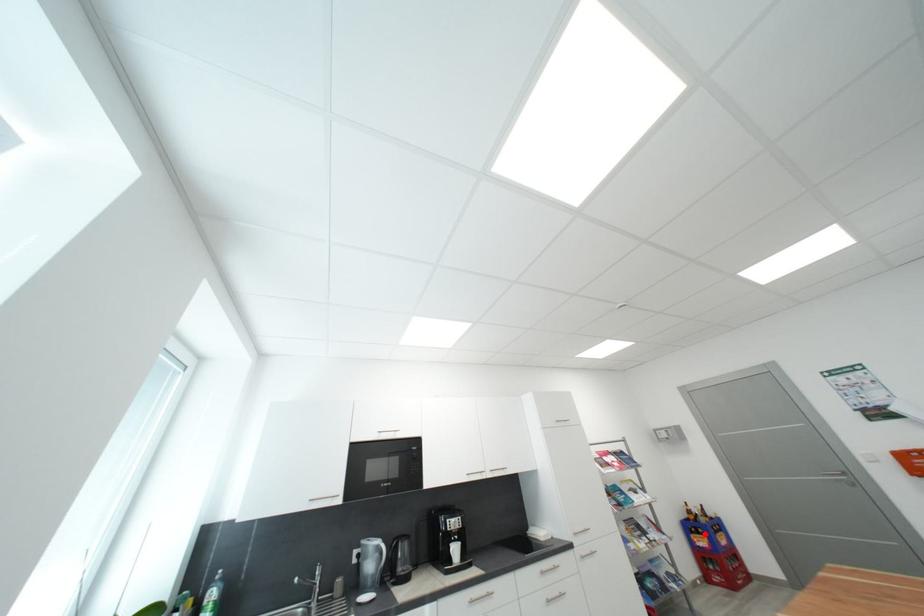
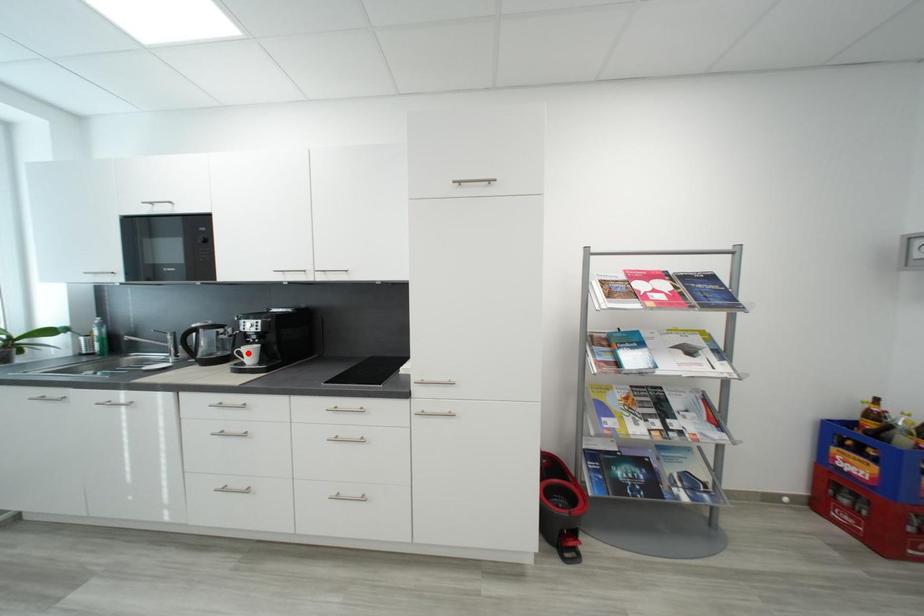
I am providing you with two images of the same scene from different viewpoints. A red point is marked on the first image and another point is marked on the second image. Does the point marked in image1 correspond to the same location as the one in image2?

No